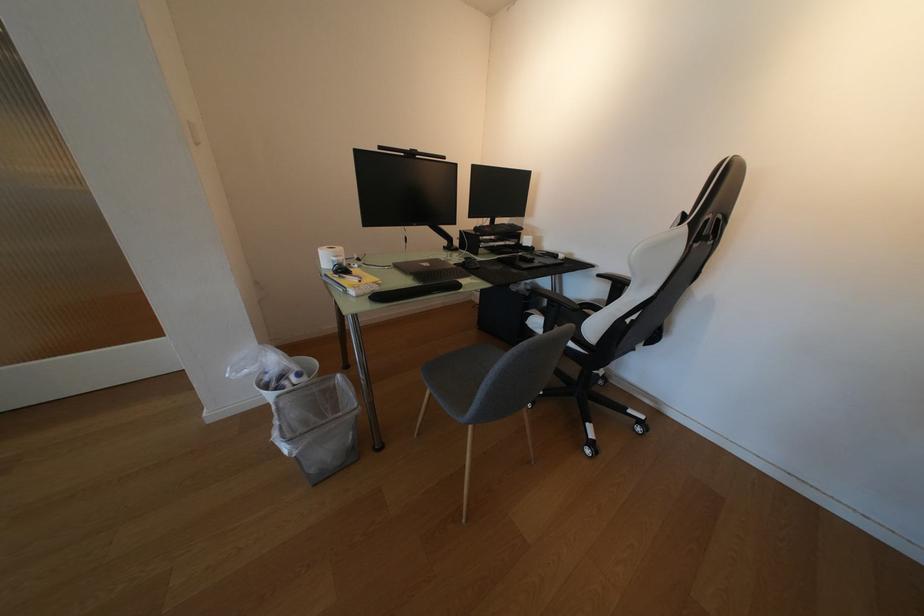
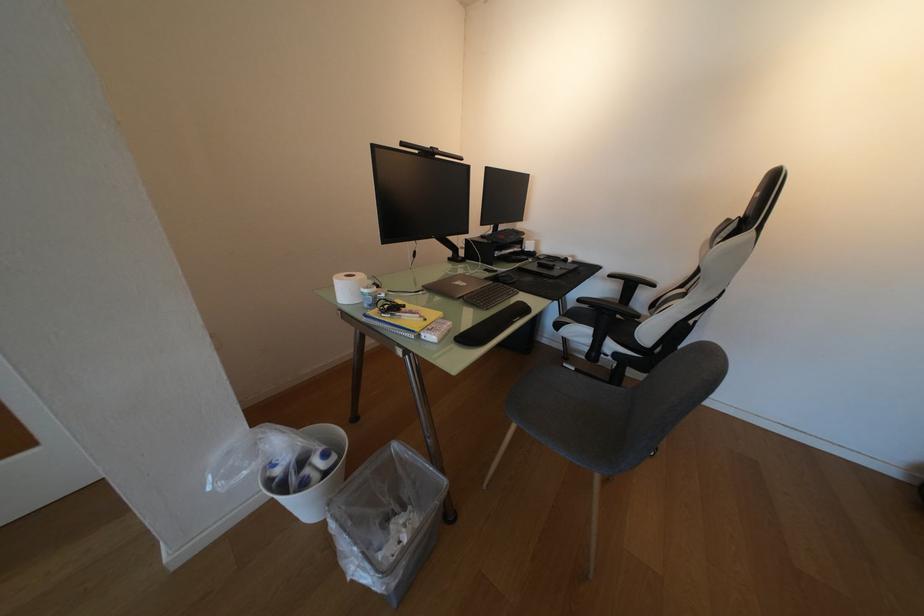
The images are taken continuously from a first-person perspective. In which direction are you moving?

The movement direction of the cameraman is left, forward.